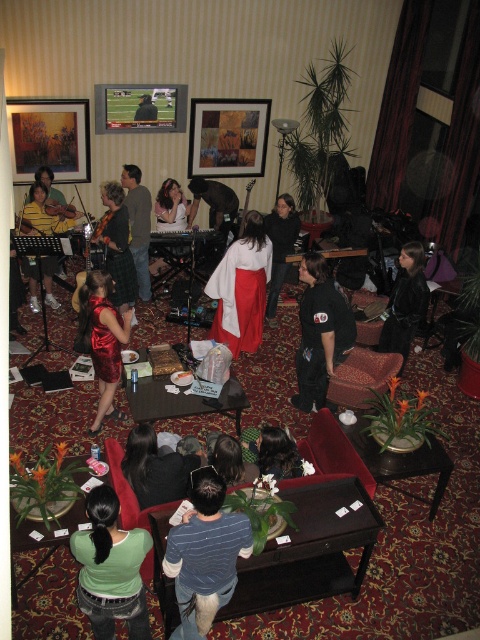
You are a photographer at the event and want to take a photo of the shiny red dress at center and dark brown hair at center. To ensure both are in frame, should you position the camera to the left or right of the two subjects?

You should position the camera to the right of the shiny red dress at center and dark brown hair at center because the shiny red dress at center is to the left of dark brown hair at center, so placing the camera to the right would capture both subjects within the frame.

You are standing in the room and want to locate the blue striped shirt at center. What are the coordinates where you should look?

The blue striped shirt at center is located at coordinates point (x=204, y=554).

You are standing at the entrance of the room and see two points marked in the image. If you were to walk directly towards point 1, which is at coordinate point (337, 300), would you pass by point 2 at coordinate point (409, 323) first?

Yes, since point (337, 300) is in front of point (409, 323), walking towards point 1 would mean passing point 2 first before reaching point 1.